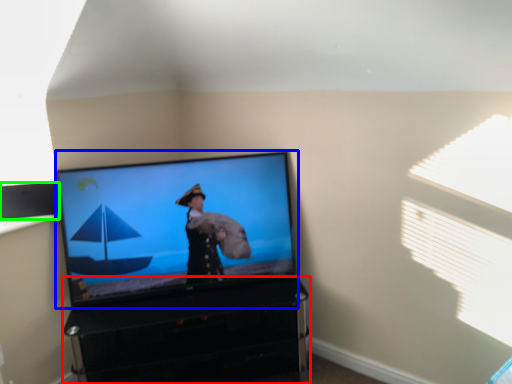
Question: Estimate the real-world distances between objects in this image. Which object is closer to furniture (highlighted by a red box), television (highlighted by a blue box) or speaker (highlighted by a green box)?

Choices:
 (A) television
 (B) speaker

Answer: (A)